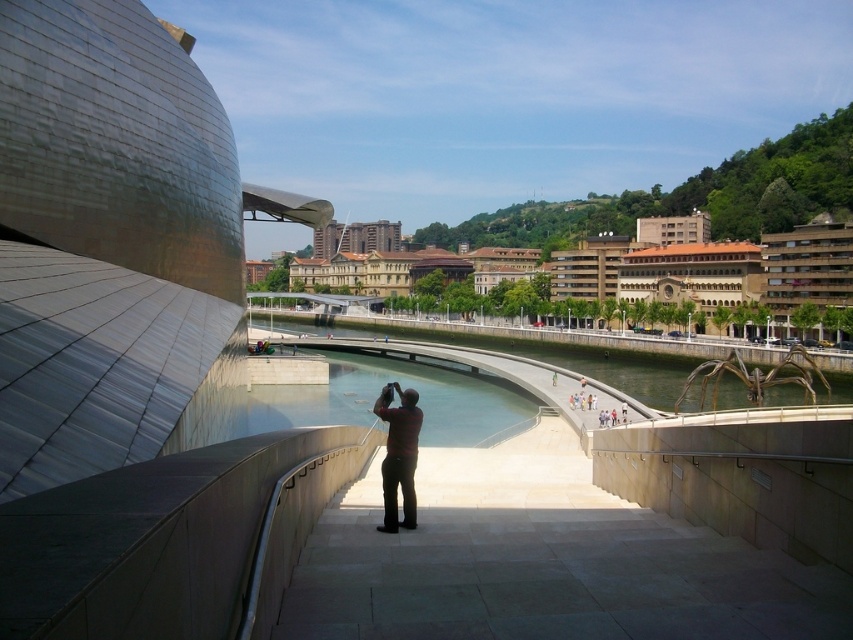
Question: Which of the following is the farthest from the observer?

Choices:
 (A) (403, 435)
 (B) (671, 244)

Answer: (B)

Question: Can you confirm if brown stone buildings at center is wider than dark red shirt at center?

Choices:
 (A) yes
 (B) no

Answer: (A)

Question: Can you confirm if brown stone buildings at center is positioned above clear glass waterway at center?

Choices:
 (A) yes
 (B) no

Answer: (A)

Question: Does brown stone buildings at center appear on the left side of clear glass waterway at center?

Choices:
 (A) no
 (B) yes

Answer: (A)

Question: Which of the following is the closest to the observer?

Choices:
 (A) dark red shirt at center
 (B) brown stone buildings at center

Answer: (A)

Question: Which point is farther to the camera?

Choices:
 (A) clear glass waterway at center
 (B) dark red shirt at center
 (C) brown stone buildings at center

Answer: (C)